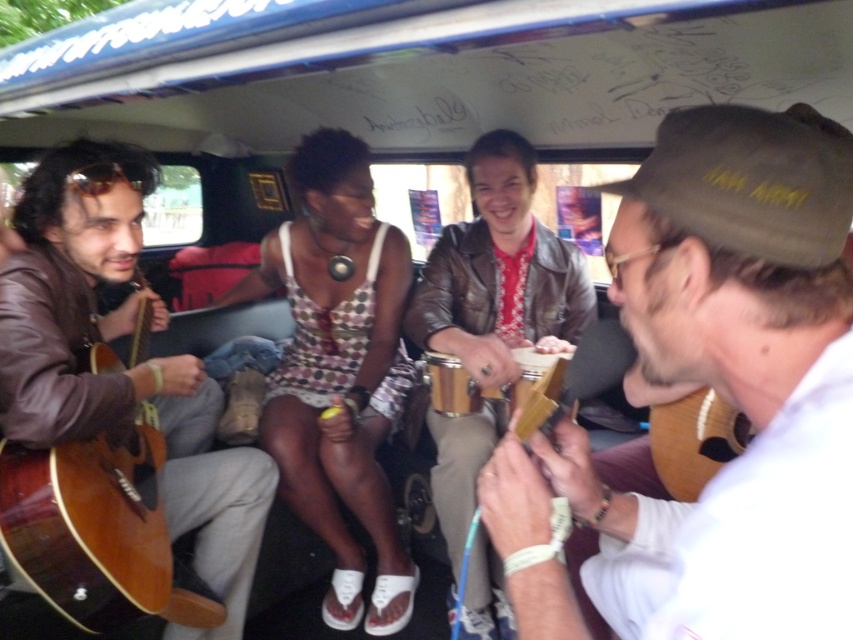
Question: Is matte brown guitar at center thinner than wooden percussion at center?

Choices:
 (A) no
 (B) yes

Answer: (A)

Question: Considering the real-world distances, which object is farthest from the leather jacket at center?

Choices:
 (A) matte brown guitar at left
 (B) matte brown guitar at center

Answer: (B)

Question: Is leather jacket at center thinner than light brown wooden guitar at lower right?

Choices:
 (A) yes
 (B) no

Answer: (B)

Question: Which point appears closest to the camera in this image?

Choices:
 (A) (137, 184)
 (B) (643, 564)

Answer: (B)

Question: Which point appears farthest from the camera in this image?

Choices:
 (A) (44, 390)
 (B) (675, 408)

Answer: (B)

Question: From the image, what is the correct spatial relationship of matte brown guitar at center in relation to matte brown guitar at left?

Choices:
 (A) left
 (B) right

Answer: (B)